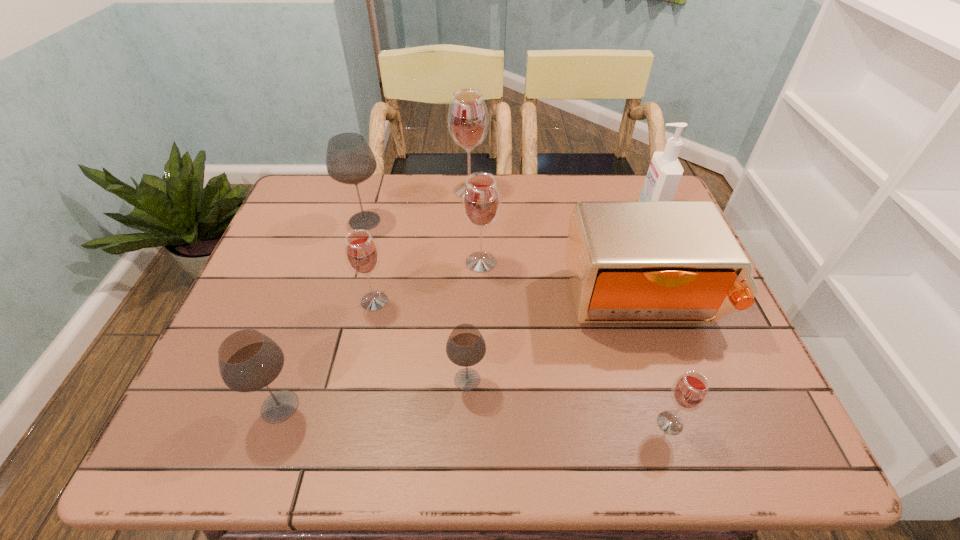
At what (x,y) coordinates should I click in order to perform the action: click on the farthest wineglass. Please return your answer as a coordinate pair (x, y). Looking at the image, I should click on (468, 120).

Image resolution: width=960 pixels, height=540 pixels. What are the coordinates of `the farthest red wineglass` in the screenshot? It's located at (468, 120).

The height and width of the screenshot is (540, 960). I want to click on cleansing agent, so click(665, 171).

Where is `the farthest gray wineglass`? Image resolution: width=960 pixels, height=540 pixels. the farthest gray wineglass is located at coordinates (349, 159).

You are a GUI agent. You are given a task and a screenshot of the screen. Output one action in this format:
    pyautogui.click(x=<x>, y=<y>)
    Task: Click on the biggest gray wineglass
    
    Given the screenshot: What is the action you would take?
    pyautogui.click(x=349, y=159)

Identify the location of the second biggest red wineglass. The width and height of the screenshot is (960, 540). (481, 202).

In order to click on the third nearest red wineglass in this screenshot , I will do `click(481, 202)`.

The image size is (960, 540). In order to click on white toaster oven in this screenshot , I will do `click(628, 261)`.

The height and width of the screenshot is (540, 960). Find the location of `the third farthest red wineglass`. the third farthest red wineglass is located at coordinates (362, 255).

The height and width of the screenshot is (540, 960). What are the coordinates of `the third biggest red wineglass` in the screenshot? It's located at (362, 255).